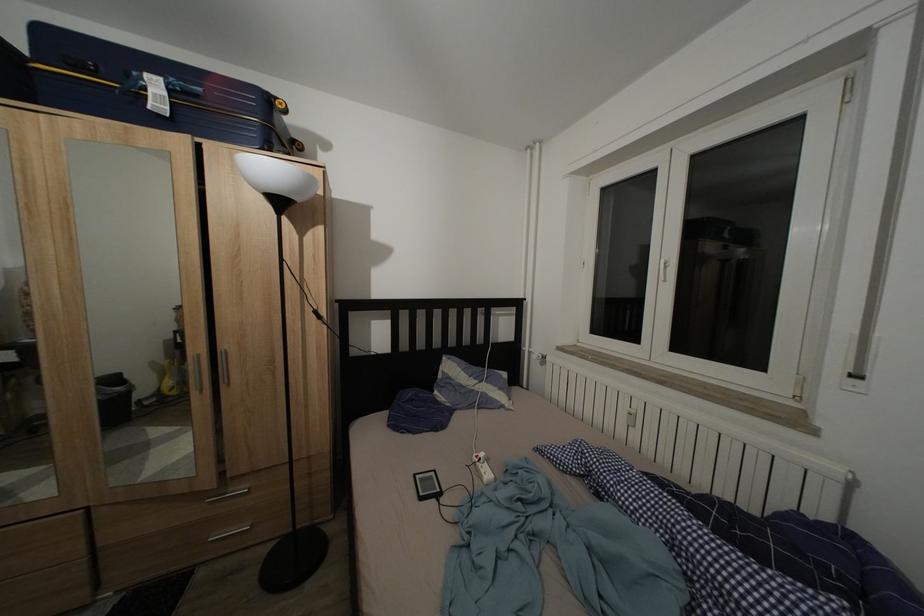
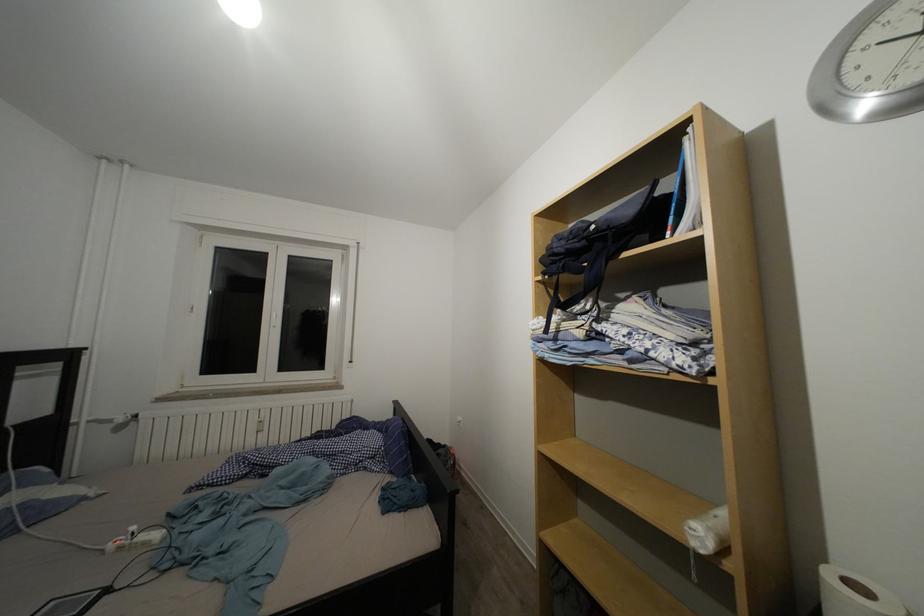
Find the pixel in the second image that matches (x=490, y=461) in the first image.

(140, 533)